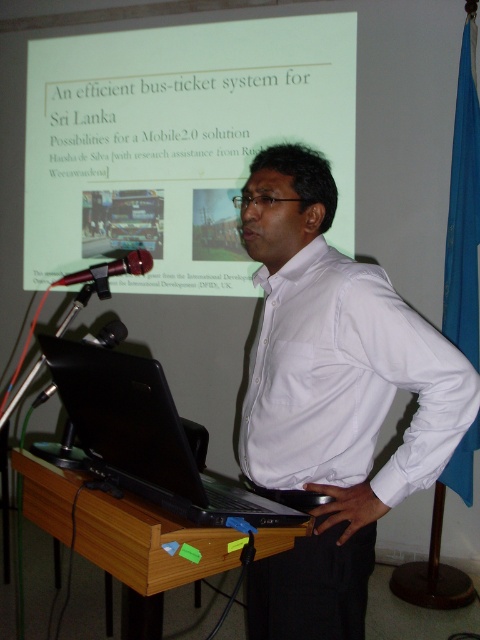
Question: Does brown wooden podium at center have a smaller size compared to metallic red microphone at left?

Choices:
 (A) yes
 (B) no

Answer: (B)

Question: Can you confirm if white paper at upper center is wider than brown wooden podium at center?

Choices:
 (A) no
 (B) yes

Answer: (B)

Question: Does white paper at upper center appear on the right side of metallic red microphone at left?

Choices:
 (A) no
 (B) yes

Answer: (A)

Question: Estimate the real-world distances between objects in this image. Which object is closer to the brown wooden podium at center?

Choices:
 (A) white smooth shirt at center
 (B) white paper at upper center

Answer: (A)

Question: Among these points, which one is nearest to the camera?

Choices:
 (A) (118, 269)
 (B) (299, 76)
 (C) (156, 426)

Answer: (C)

Question: Which object is positioned farthest from the black matte laptop at lower left?

Choices:
 (A) brown wooden podium at center
 (B) white smooth shirt at center
 (C) metallic red microphone at left
 (D) white paper at upper center

Answer: (D)